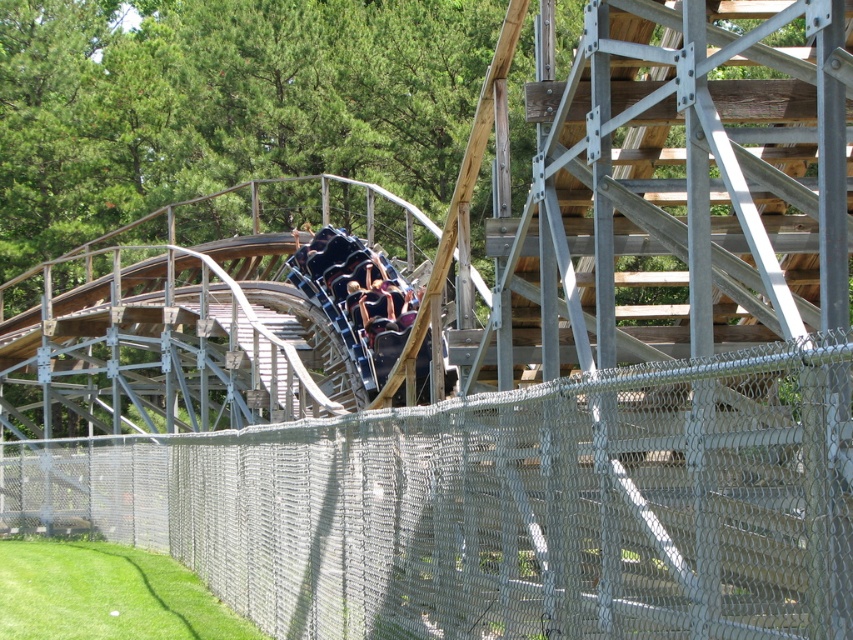
Question: In this image, where is silver chain-link fence at center located relative to metallic blue slide at center?

Choices:
 (A) above
 (B) below

Answer: (B)

Question: Which of the following is the closest to the observer?

Choices:
 (A) silver chain-link fence at center
 (B) metallic blue slide at center

Answer: (A)

Question: Is silver chain-link fence at center thinner than metallic blue slide at center?

Choices:
 (A) yes
 (B) no

Answer: (B)

Question: Which object appears closest to the camera in this image?

Choices:
 (A) silver chain-link fence at center
 (B) metallic blue slide at center

Answer: (A)

Question: Is silver chain-link fence at center to the right of metallic blue slide at center from the viewer's perspective?

Choices:
 (A) yes
 (B) no

Answer: (B)